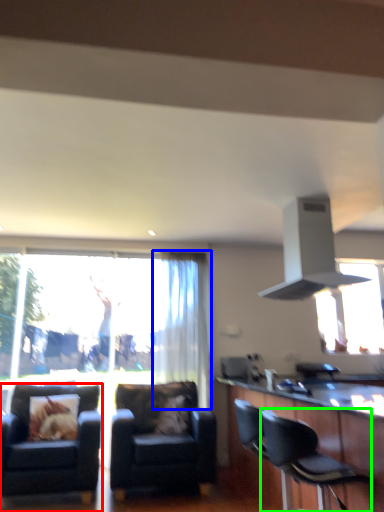
Question: Which object is positioned farthest from chair (highlighted by a red box)? Select from curtain (highlighted by a blue box) and chair (highlighted by a green box).

Choices:
 (A) curtain
 (B) chair

Answer: (B)